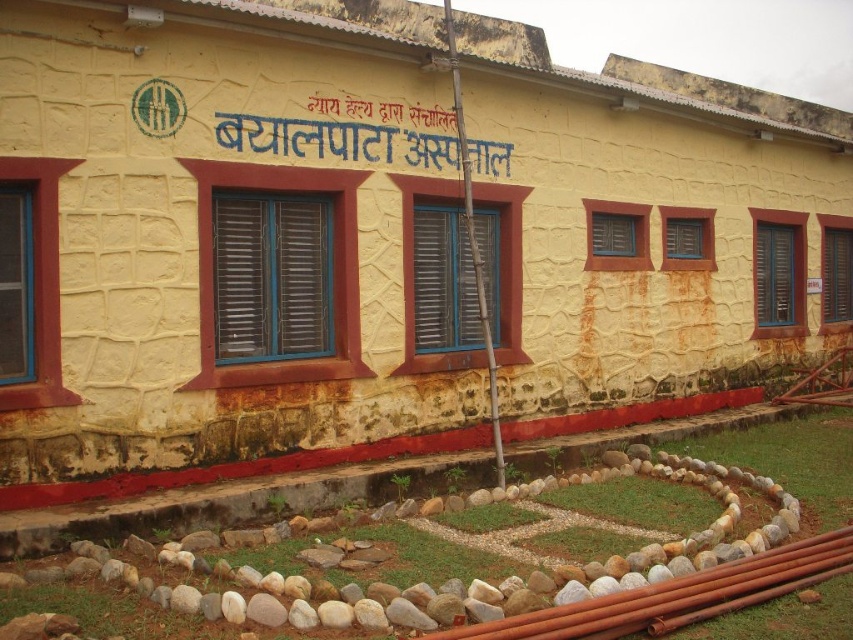
You are a delivery person arriving at Byalapata Hospital. You see a brown metallic pipes at lower right and a blue painted signboard at center. Which object takes up more space in the scene?

The blue painted signboard at center takes up more space than the brown metallic pipes at lower right because the brown metallic pipes at lower right occupies less space than blue painted signboard at center.

You are a delivery person who needs to hand over a package to the hospital reception. You are standing in front of the building and see the brown metallic pipes at lower right and the blue painted signboard at center. Which object is closer to you?

The brown metallic pipes at lower right are closer to you because they are in front of the blue painted signboard at center.